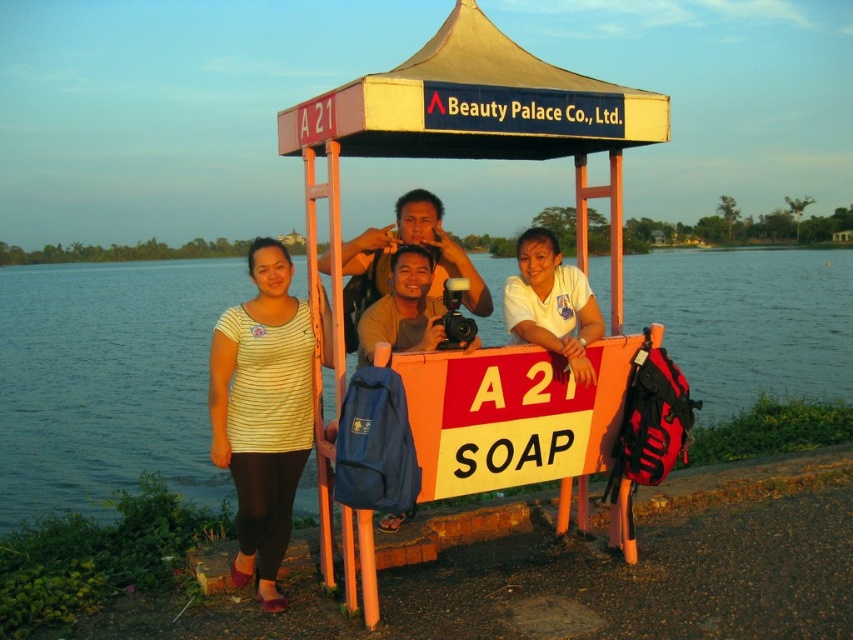
Question: Estimate the real-world distances between objects in this image. Which object is closer to the striped fabric shirt at left?

Choices:
 (A) blue water at center
 (B) white fabric gazebo at center
 (C) white matte shirt at center
 (D) yellow fabric canopy at upper center

Answer: (B)

Question: Is yellow fabric canopy at upper center to the left of striped fabric shirt at left from the viewer's perspective?

Choices:
 (A) yes
 (B) no

Answer: (B)

Question: Does yellow fabric canopy at upper center appear under striped fabric shirt at left?

Choices:
 (A) no
 (B) yes

Answer: (A)

Question: Does white fabric gazebo at center have a greater width compared to striped fabric shirt at left?

Choices:
 (A) no
 (B) yes

Answer: (B)

Question: Estimate the real-world distances between objects in this image. Which object is farther from the yellow fabric canopy at upper center?

Choices:
 (A) striped fabric shirt at left
 (B) blue water at center

Answer: (B)

Question: Which point is closer to the camera?

Choices:
 (A) (263, 412)
 (B) (811, 280)

Answer: (A)